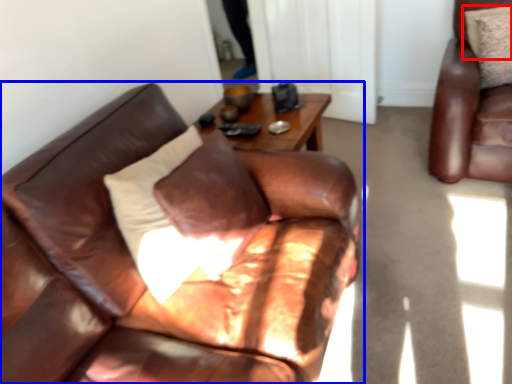
Question: Which of the following is the farthest to the observer, pillow (highlighted by a red box) or studio couch (highlighted by a blue box)?

Choices:
 (A) pillow
 (B) studio couch

Answer: (A)